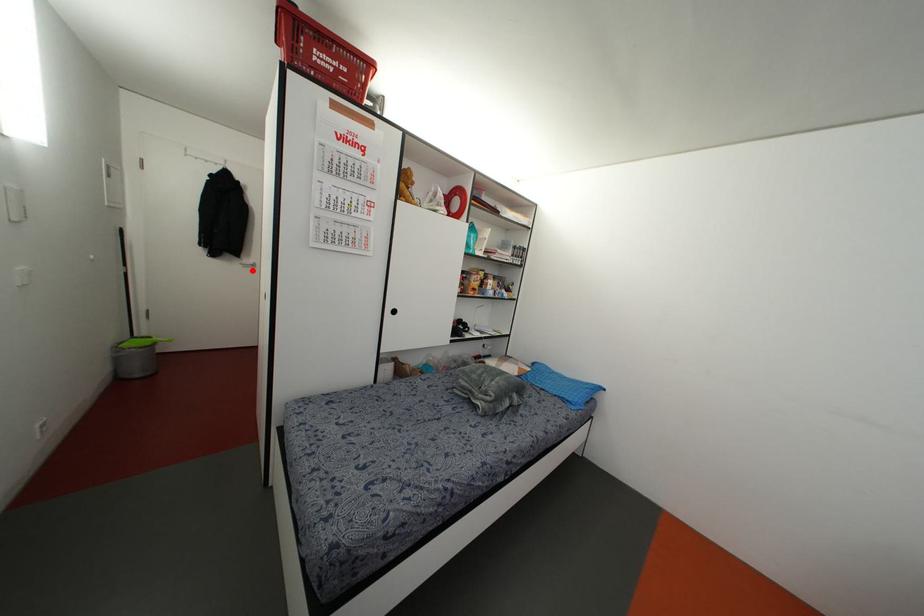
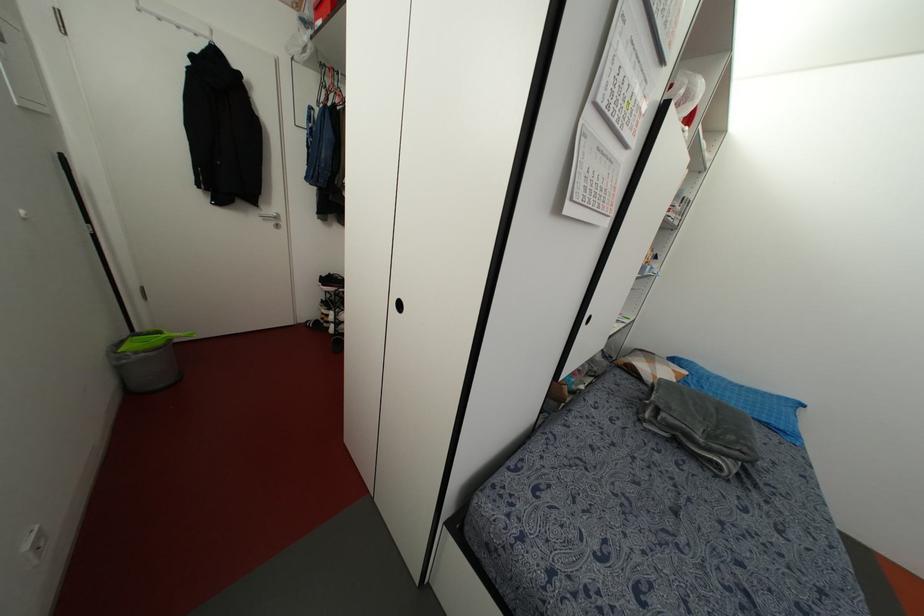
Find the pixel in the second image that matches the highlighted location in the first image.

(276, 225)